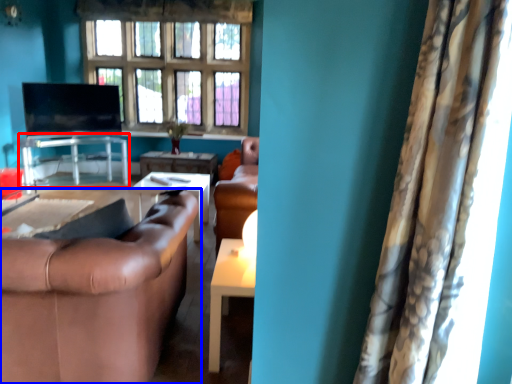
Question: Among these objects, which one is nearest to the camera, table (highlighted by a red box) or studio couch (highlighted by a blue box)?

Choices:
 (A) table
 (B) studio couch

Answer: (B)